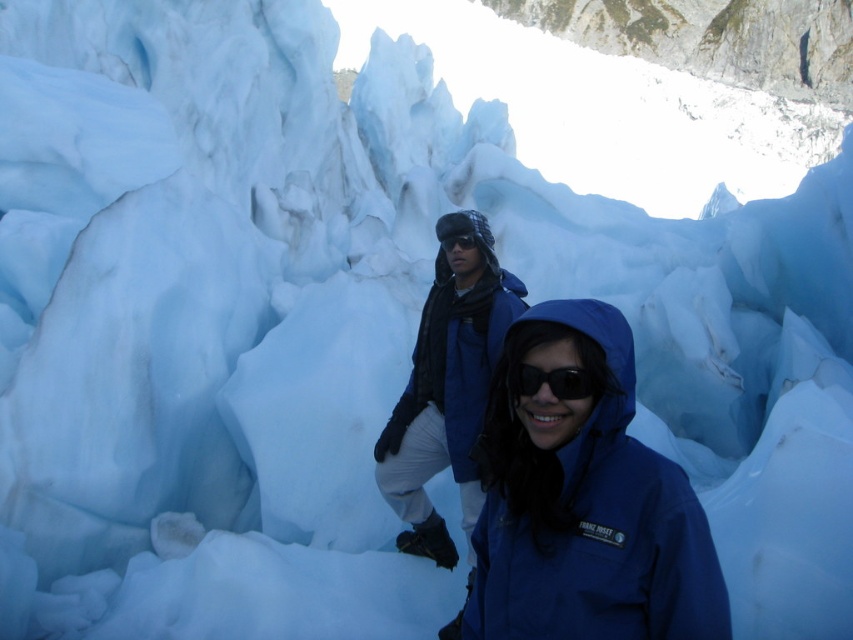
Question: Which of these objects is positioned closest to the matte blue jacket at center?

Choices:
 (A) black reflective sunglasses at center
 (B) transparent plastic goggles at center
 (C) blue matte jacket at center

Answer: (B)

Question: Does blue matte jacket at center appear under transparent plastic goggles at center?

Choices:
 (A) yes
 (B) no

Answer: (A)

Question: Which point is closer to the camera taking this photo?

Choices:
 (A) (515, 541)
 (B) (561, 392)

Answer: (B)

Question: Which of the following is the closest to the observer?

Choices:
 (A) blue matte jacket at center
 (B) transparent plastic goggles at center

Answer: (A)

Question: In this image, where is black reflective sunglasses at center located relative to transparent plastic goggles at center?

Choices:
 (A) above
 (B) below

Answer: (B)

Question: Does blue matte jacket at center come behind matte blue jacket at center?

Choices:
 (A) yes
 (B) no

Answer: (B)